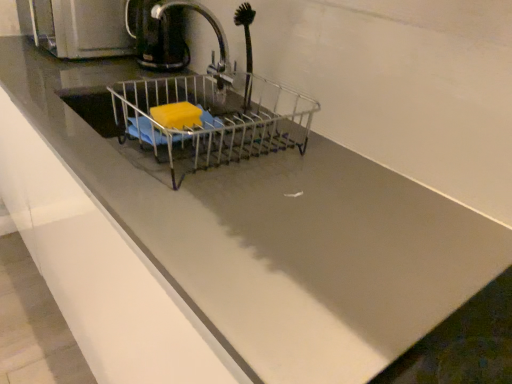
Question: From the image's perspective, is metallic faucet at center located above metallic wire basket at center?

Choices:
 (A) no
 (B) yes

Answer: (B)

Question: Can metallic wire basket at center be found inside metallic faucet at center?

Choices:
 (A) yes
 (B) no

Answer: (B)

Question: Can you confirm if metallic faucet at center is thinner than metallic wire basket at center?

Choices:
 (A) no
 (B) yes

Answer: (B)

Question: From a real-world perspective, is metallic faucet at center on metallic wire basket at center?

Choices:
 (A) yes
 (B) no

Answer: (A)

Question: Considering the relative positions of metallic faucet at center and metallic wire basket at center in the image provided, is metallic faucet at center to the right of metallic wire basket at center from the viewer's perspective?

Choices:
 (A) yes
 (B) no

Answer: (B)

Question: Does metallic faucet at center come behind metallic wire basket at center?

Choices:
 (A) no
 (B) yes

Answer: (B)

Question: From a real-world perspective, is metallic faucet at center positioned over black plastic coffee pot at upper left based on gravity?

Choices:
 (A) yes
 (B) no

Answer: (B)

Question: Considering the relative positions of metallic faucet at center and black plastic coffee pot at upper left in the image provided, is metallic faucet at center to the right of black plastic coffee pot at upper left from the viewer's perspective?

Choices:
 (A) no
 (B) yes

Answer: (B)

Question: From the image's perspective, does metallic faucet at center appear lower than black plastic coffee pot at upper left?

Choices:
 (A) yes
 (B) no

Answer: (A)

Question: Is metallic faucet at center taller than black plastic coffee pot at upper left?

Choices:
 (A) yes
 (B) no

Answer: (A)

Question: Considering the relative positions of metallic faucet at center and black plastic coffee pot at upper left in the image provided, is metallic faucet at center to the left of black plastic coffee pot at upper left from the viewer's perspective?

Choices:
 (A) yes
 (B) no

Answer: (B)

Question: Is metallic faucet at center oriented towards black plastic coffee pot at upper left?

Choices:
 (A) yes
 (B) no

Answer: (B)

Question: From the image's perspective, would you say metallic wire basket at center is positioned over black rubber brush at upper center?

Choices:
 (A) no
 (B) yes

Answer: (A)